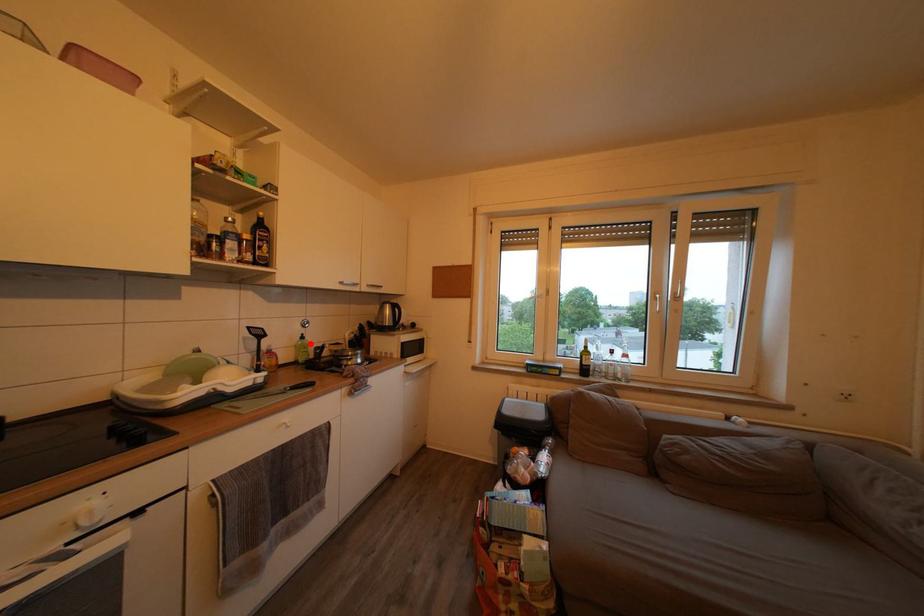
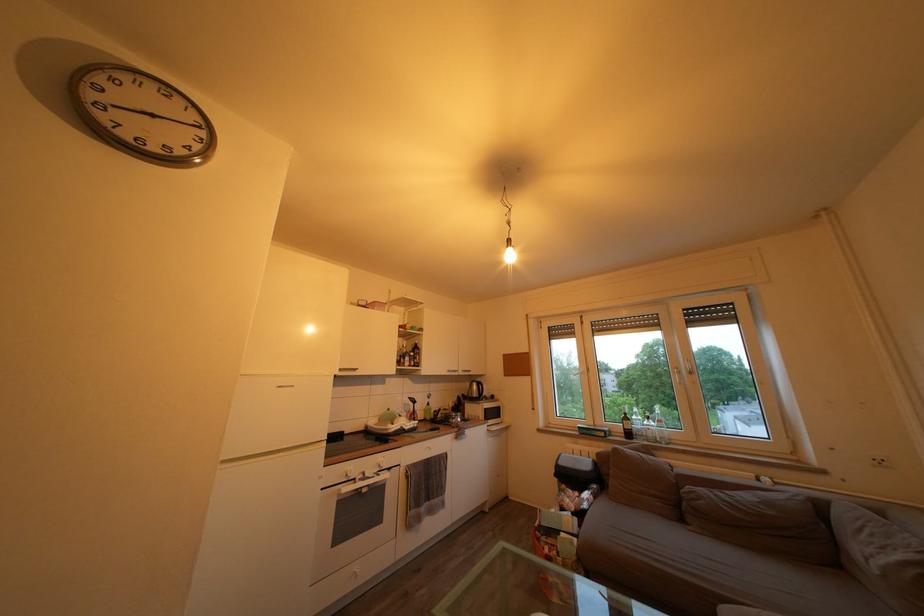
Question: I am providing you with two images of the same scene from different viewpoints. A red point is marked on the first image. Can you still see the location of the red point in image 2?

Choices:
 (A) Yes
 (B) No

Answer: (A)